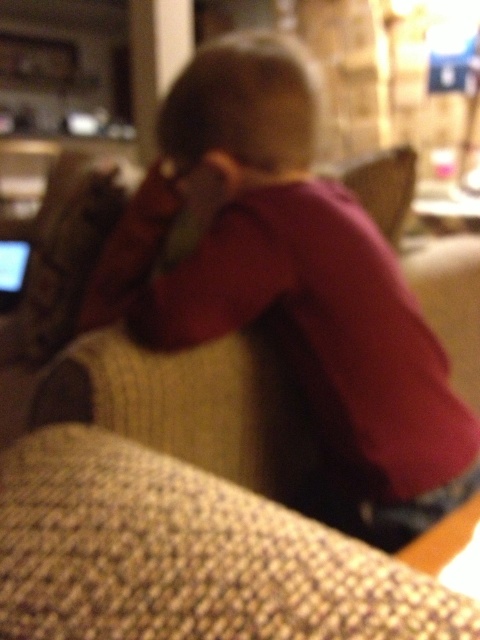
You are a fashion designer observing the image. You notice the pink fabric shirt at center and the knitted beige couch at center. Which item is placed higher in the image?

The pink fabric shirt at center is positioned over the knitted beige couch at center, so it is higher in the image.

You are organizing a photo shoot and need to ensure that the pink fabric shirt at center and the matte black laptop at left are clearly visible in the final image. Given that the camera can only focus on one object at a time, which object should you choose to focus on to ensure the larger object is sharp?

The pink fabric shirt at center has a larger size compared to the matte black laptop at left, so you should focus on the pink fabric shirt at center to ensure the larger object is sharp.

You are a fashion designer observing a model wearing a pink fabric shirt at center and sitting on a knitted beige couch at center. Which item has a greater height in the image?

The pink fabric shirt at center is taller than the knitted beige couch at center according to the description.